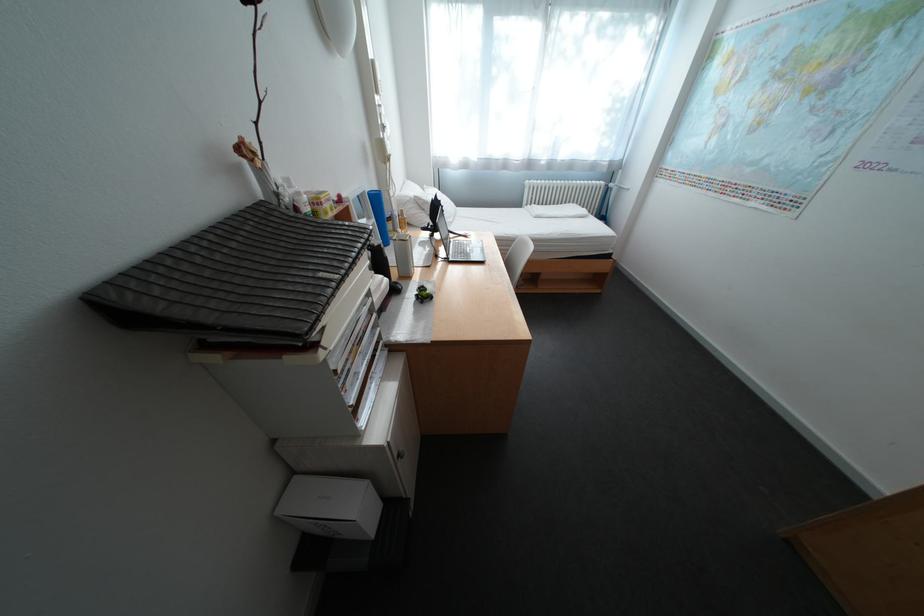
Where is `white pillow`? This screenshot has height=616, width=924. white pillow is located at coordinates (420, 203).